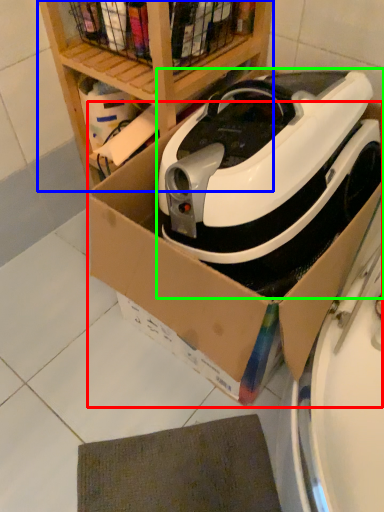
Question: Which object is the farthest from cardboard box (highlighted by a red box)? Choose among these: shelf (highlighted by a blue box) or home appliance (highlighted by a green box).

Choices:
 (A) shelf
 (B) home appliance

Answer: (A)